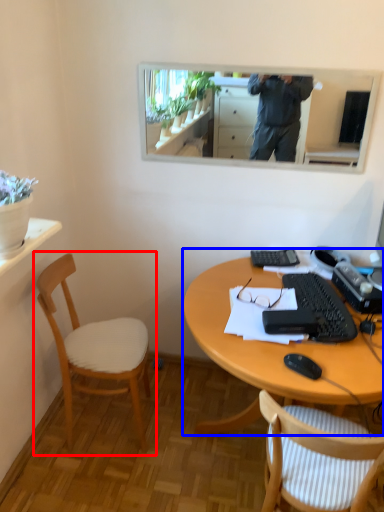
Question: Among these objects, which one is nearest to the camera, chair (highlighted by a red box) or desk (highlighted by a blue box)?

Choices:
 (A) chair
 (B) desk

Answer: (B)